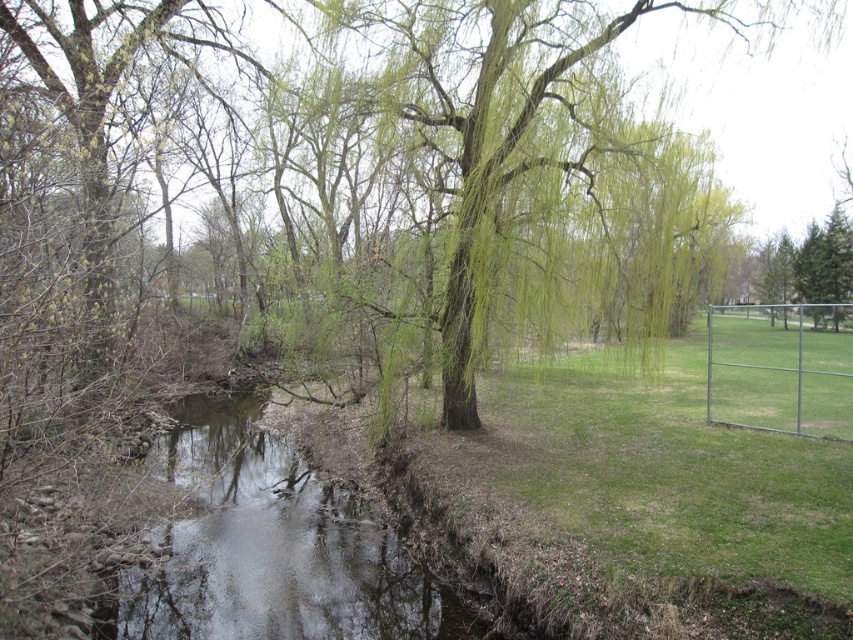
Can you confirm if clear water at center is shorter than metallic silver fence at right?

Indeed, clear water at center has a lesser height compared to metallic silver fence at right.

Does clear water at center have a greater height compared to metallic silver fence at right?

No, clear water at center is not taller than metallic silver fence at right.

Between point (245, 616) and point (802, 308), which one is positioned behind?

Point (802, 308)

Where is `clear water at center`? Image resolution: width=853 pixels, height=640 pixels. clear water at center is located at coordinates (271, 547).

Is green leafy willow at center above metallic silver fence at right?

Indeed, green leafy willow at center is positioned over metallic silver fence at right.

Who is positioned more to the left, green leafy willow at center or metallic silver fence at right?

From the viewer's perspective, green leafy willow at center appears more on the left side.

Find the location of a particular element. The width and height of the screenshot is (853, 640). green leafy willow at center is located at coordinates (757, 104).

Looking at this image, does clear water at center have a smaller size compared to green leafy willow at center?

Yes, clear water at center is smaller than green leafy willow at center.

Who is more forward, (328, 548) or (820, 52)?

Point (328, 548)

At what (x,y) coordinates should I click in order to perform the action: click on clear water at center. Please return your answer as a coordinate pair (x, y). Looking at the image, I should click on (271, 547).